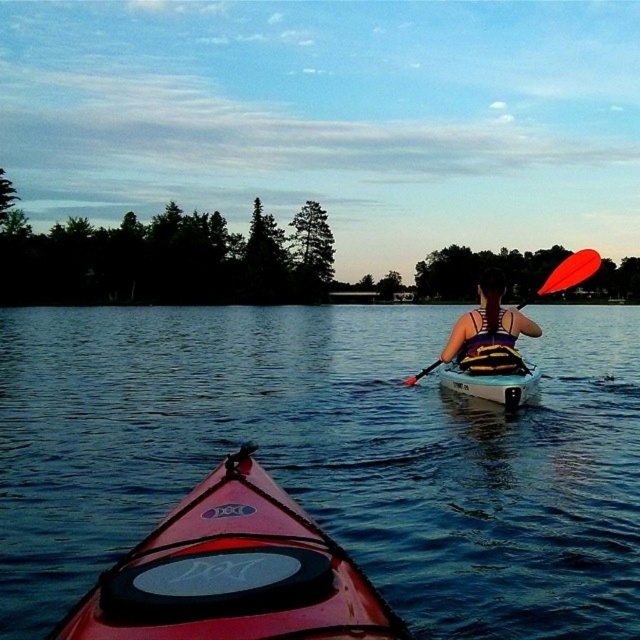
You are planning to take a photo of the kayaking scene. You want to ensure both the transparent water at center and the matte yellow life vest at center are clearly visible in the frame. Given their widths, which object will require a wider angle to capture fully?

The transparent water at center requires a wider angle to capture fully because its width surpasses that of the matte yellow life vest at center.

You are standing on the shore of the lake and see the transparent water at center and the white plastic canoe at center. If you want to throw a stone to hit both objects, what is the minimum distance you need to throw?

The minimum distance you need to throw is 8.51 meters, as the transparent water at center and the white plastic canoe at center are 8.51 meters apart.

You are standing on the shore and see the transparent water at center and the white plastic canoe at center in the middle of the lake. Which one is located to the left when looking from your perspective?

The transparent water at center is positioned on the left side of white plastic canoe at center, so from your perspective on the shore, the transparent water at center is to the left of the white plastic canoe at center.